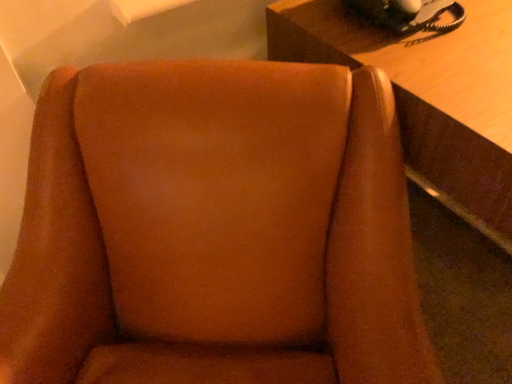
Question: Is wooden table at upper right far from brown suede chair at center?

Choices:
 (A) no
 (B) yes

Answer: (A)

Question: Is wooden table at upper right at the left side of brown suede chair at center?

Choices:
 (A) yes
 (B) no

Answer: (B)

Question: Is wooden table at upper right outside brown suede chair at center?

Choices:
 (A) no
 (B) yes

Answer: (B)

Question: Does wooden table at upper right have a smaller size compared to brown suede chair at center?

Choices:
 (A) yes
 (B) no

Answer: (B)

Question: From the image's perspective, is wooden table at upper right located above brown suede chair at center?

Choices:
 (A) no
 (B) yes

Answer: (B)

Question: From a real-world perspective, is wooden table at upper right positioned over brown suede chair at center based on gravity?

Choices:
 (A) no
 (B) yes

Answer: (A)

Question: Can you confirm if black rubberized phone at upper right is taller than wooden table at upper right?

Choices:
 (A) no
 (B) yes

Answer: (A)

Question: Is black rubberized phone at upper right aimed at wooden table at upper right?

Choices:
 (A) yes
 (B) no

Answer: (B)

Question: Considering the relative positions of black rubberized phone at upper right and wooden table at upper right in the image provided, is black rubberized phone at upper right behind wooden table at upper right?

Choices:
 (A) no
 (B) yes

Answer: (B)

Question: Considering the relative sizes of black rubberized phone at upper right and wooden table at upper right in the image provided, is black rubberized phone at upper right bigger than wooden table at upper right?

Choices:
 (A) yes
 (B) no

Answer: (B)

Question: Is black rubberized phone at upper right wider than wooden table at upper right?

Choices:
 (A) no
 (B) yes

Answer: (A)

Question: From the image's perspective, does black rubberized phone at upper right appear higher than wooden table at upper right?

Choices:
 (A) yes
 (B) no

Answer: (A)

Question: Could you tell me if brown suede chair at center is turned towards black rubberized phone at upper right?

Choices:
 (A) no
 (B) yes

Answer: (A)